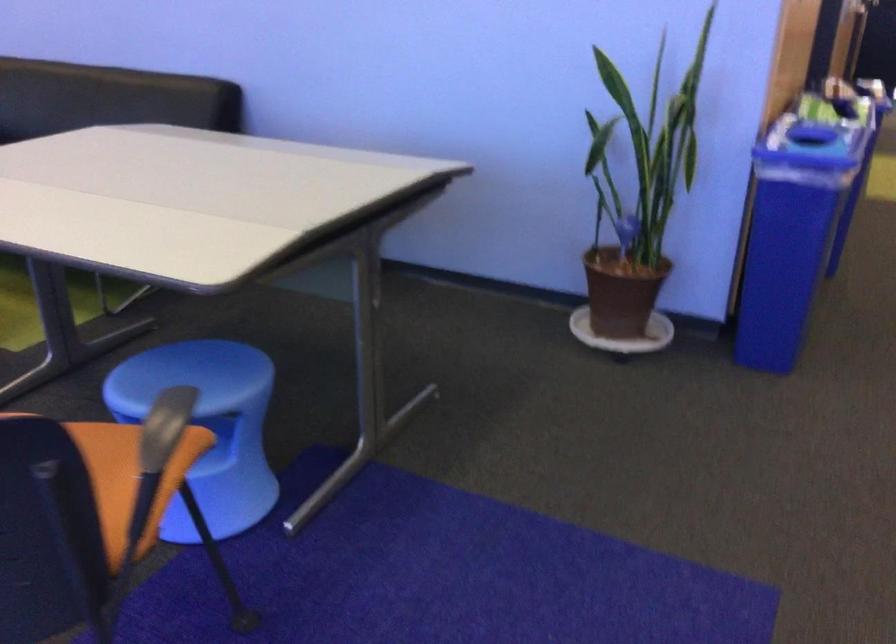
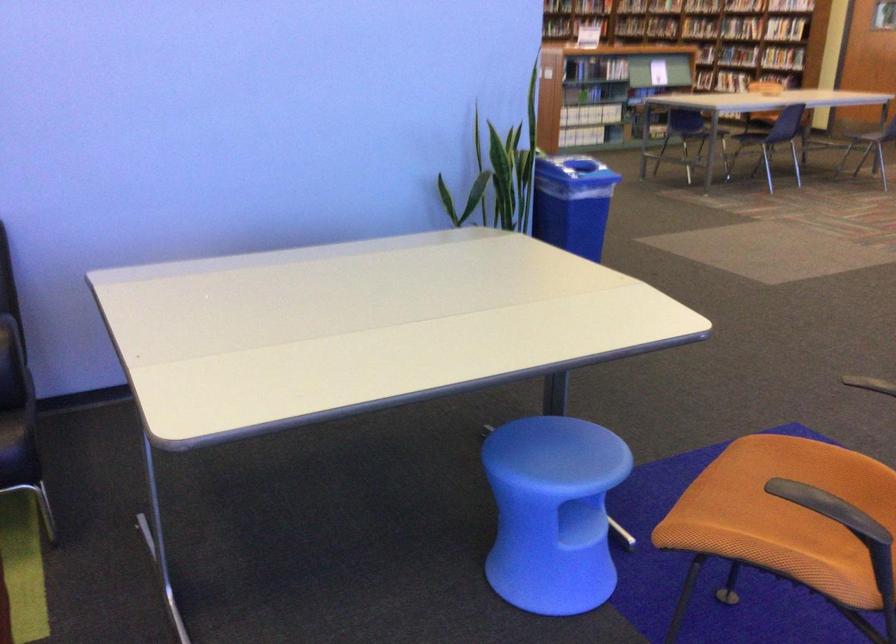
Question: I am providing you with two images of the same scene from different viewpoints. Which of the following objects are not visible in image2?

Choices:
 (A) orange chair sitting surface
 (B) book on shelf
 (C) blue plastic stool
 (D) none of these

Answer: (D)